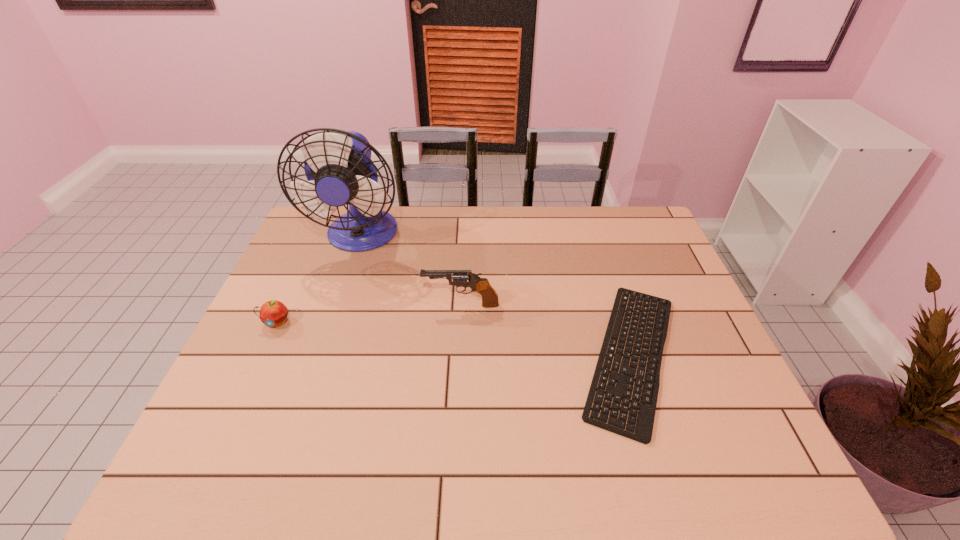
Locate an element on the screen. This screenshot has height=540, width=960. vacant area at the far edge is located at coordinates (506, 240).

Locate an element on the screen. vacant space at the near edge of the desktop is located at coordinates (691, 474).

In the image, there is a desktop. At what (x,y) coordinates should I click in order to perform the action: click on free space at the left edge. Please return your answer as a coordinate pair (x, y). Looking at the image, I should click on (334, 268).

Where is `blank space at the right edge of the desktop`? blank space at the right edge of the desktop is located at coordinates (708, 333).

Identify the location of vacant region at the far left corner of the desktop. This screenshot has width=960, height=540. (324, 237).

This screenshot has width=960, height=540. Find the location of `free point at the far right corner`. free point at the far right corner is located at coordinates (641, 212).

Find the location of a particular element. This screenshot has height=540, width=960. blank region between the shortest object and the second object from right to left is located at coordinates (546, 330).

This screenshot has width=960, height=540. What are the coordinates of `free spot between the third shortest object and the apple` in the screenshot? It's located at (369, 314).

At what (x,y) coordinates should I click in order to perform the action: click on unoccupied position between the second tallest object and the apple. Please return your answer as a coordinate pair (x, y). This screenshot has width=960, height=540. Looking at the image, I should click on (369, 314).

Where is `vacant space that's between the gun and the third tallest object`? vacant space that's between the gun and the third tallest object is located at coordinates (369, 314).